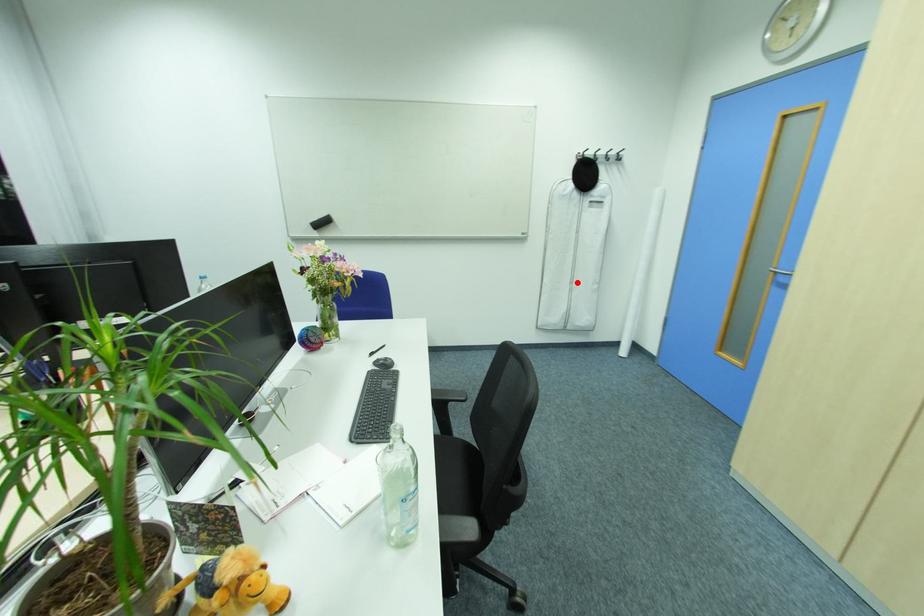
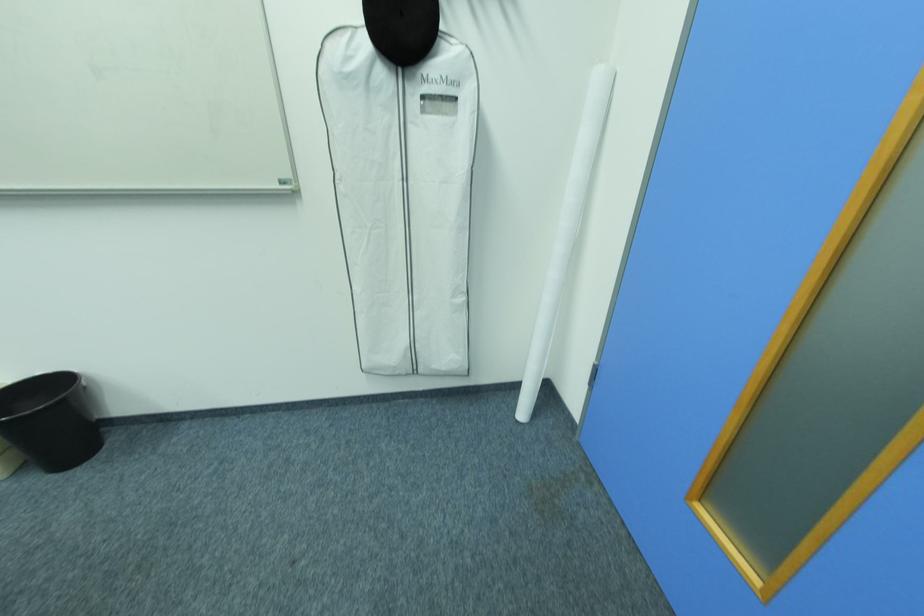
Find the pixel in the second image that matches the highlighted location in the first image.

(416, 292)